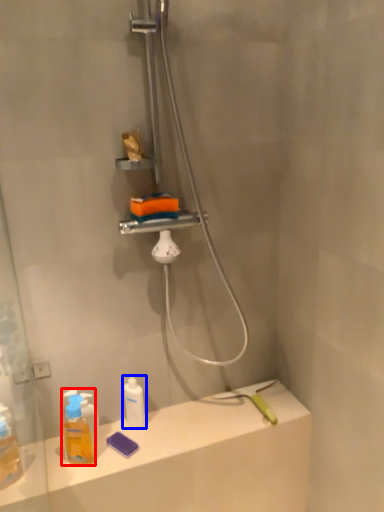
Question: Which point is closer to the camera, mouthwash (highlighted by a red box) or mouthwash (highlighted by a blue box)?

Choices:
 (A) mouthwash
 (B) mouthwash

Answer: (A)